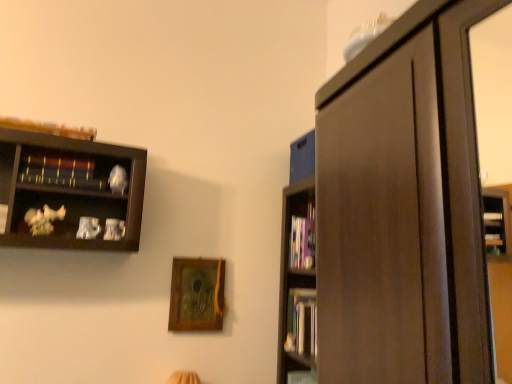
Question: Is wooden book at upper left, which is counted as the 1th book, starting from the left, taller or shorter than wooden bookshelf at upper left, which appears as the second book when viewed from the front?

Choices:
 (A) tall
 (B) short

Answer: (B)

Question: In the image, is wooden book at upper left, which is counted as the 1th book, starting from the left, positioned in front of or behind wooden bookshelf at upper left, placed as the third book when sorted from bottom to top?

Choices:
 (A) front
 (B) behind

Answer: (A)

Question: Estimate the real-world distances between objects in this image. Which object is farther from the wooden picture frame at center?

Choices:
 (A) hardcover books at right, the third book in the front-to-back sequence
 (B) wooden book at upper left, which ranks as the fourth book in right-to-left order
 (C) hardcover book at center, the second book positioned from the bottom
 (D) wooden bookshelf at upper left, which ranks as the 3th book in right-to-left order

Answer: (B)

Question: Estimate the real-world distances between objects in this image. Which object is farther from the hardcover books at right, the 2th book positioned from the back?

Choices:
 (A) hardcover book at center, acting as the fourth book starting from the front
 (B) wooden book at upper left, which is counted as the 1th book, starting from the left
 (C) wooden picture frame at center
 (D) wooden bookshelf at upper left, arranged as the second book when viewed from the top

Answer: (B)